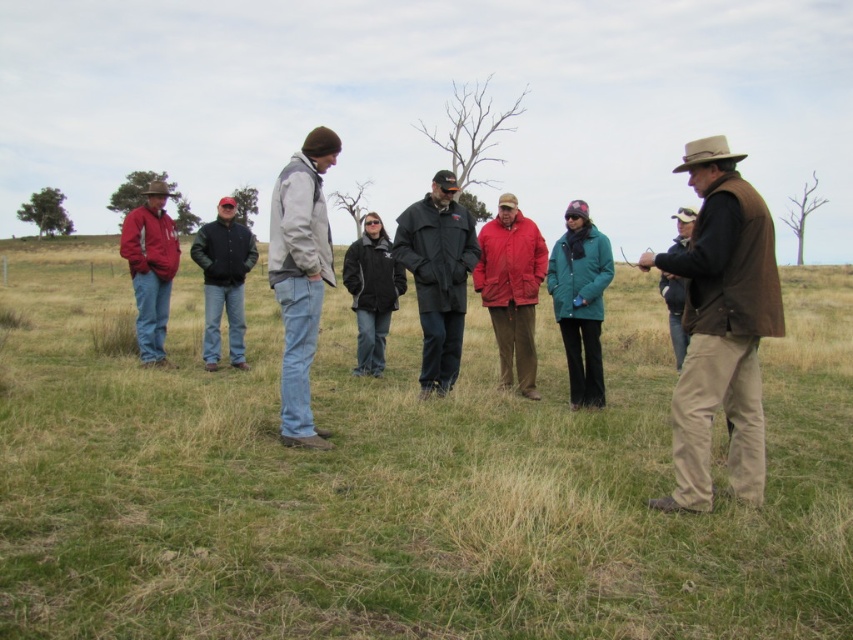
Question: Is matte red jacket at left smaller than brown leather jacket at right?

Choices:
 (A) yes
 (B) no

Answer: (A)

Question: Is green grassy at center closer to the viewer compared to brown leather jacket at right?

Choices:
 (A) no
 (B) yes

Answer: (B)

Question: Which point is closer to the camera?

Choices:
 (A) (669, 294)
 (B) (380, 276)
 (C) (561, 314)
 (D) (212, 371)

Answer: (C)

Question: Which of these objects is positioned closest to the brown leather jacket at right?

Choices:
 (A) matte red jacket at left
 (B) black matte jacket at center

Answer: (B)

Question: Which object is positioned farthest from the brown leather jacket at right?

Choices:
 (A) green grassy at center
 (B) black softshell jacket at center
 (C) dark green leather jacket at center

Answer: (A)

Question: Is green grassy at center thinner than brown suede vest at center?

Choices:
 (A) no
 (B) yes

Answer: (A)